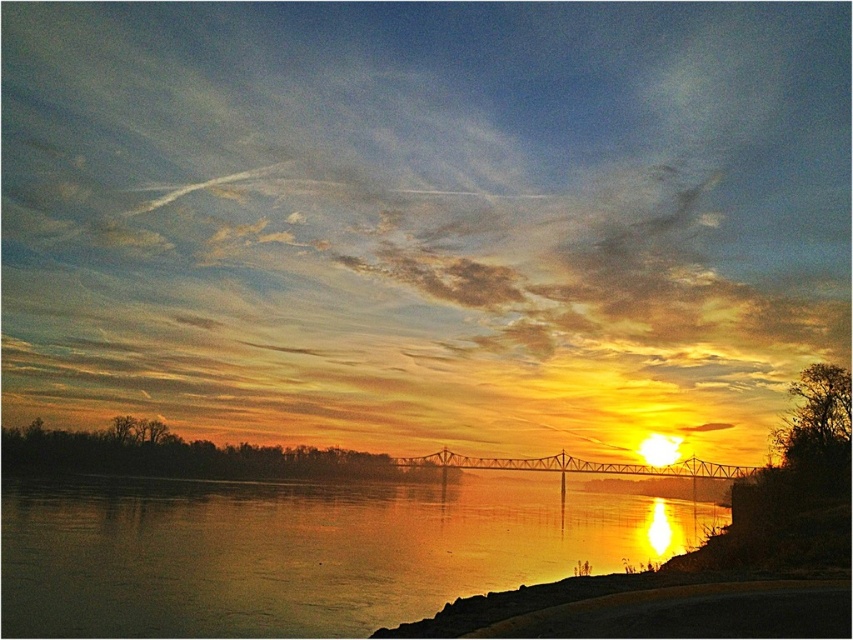
Is glossy water at center closer to the viewer compared to metallic bridge at center?

Yes, glossy water at center is closer to the viewer.

Who is taller, glossy water at center or metallic bridge at center?

glossy water at center is taller.

Does point (302, 524) come farther from viewer compared to point (442, 461)?

No, (302, 524) is closer to viewer.

You are a GUI agent. You are given a task and a screenshot of the screen. Output one action in this format:
    pyautogui.click(x=<x>, y=<y>)
    Task: Click on the glossy water at center
    
    Given the screenshot: What is the action you would take?
    pyautogui.click(x=302, y=550)